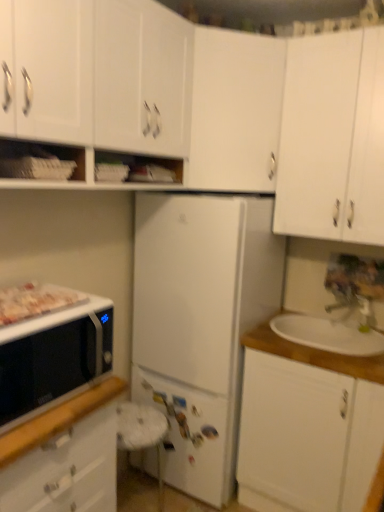
At what (x,y) coordinates should I click in order to perform the action: click on free space above white glossy tray at left (from a real-world perspective). Please return your answer as a coordinate pair (x, y). This screenshot has height=512, width=384. Looking at the image, I should click on (32, 294).